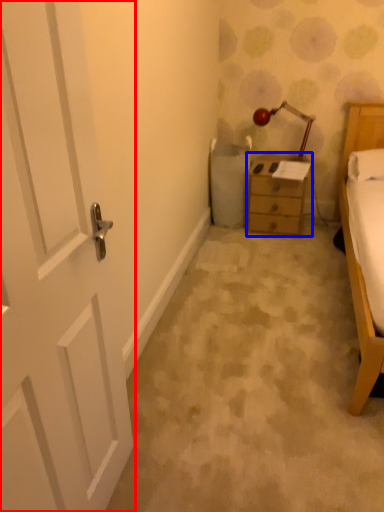
Question: Which of the following is the farthest to the observer, door (highlighted by a red box) or nightstand (highlighted by a blue box)?

Choices:
 (A) door
 (B) nightstand

Answer: (B)